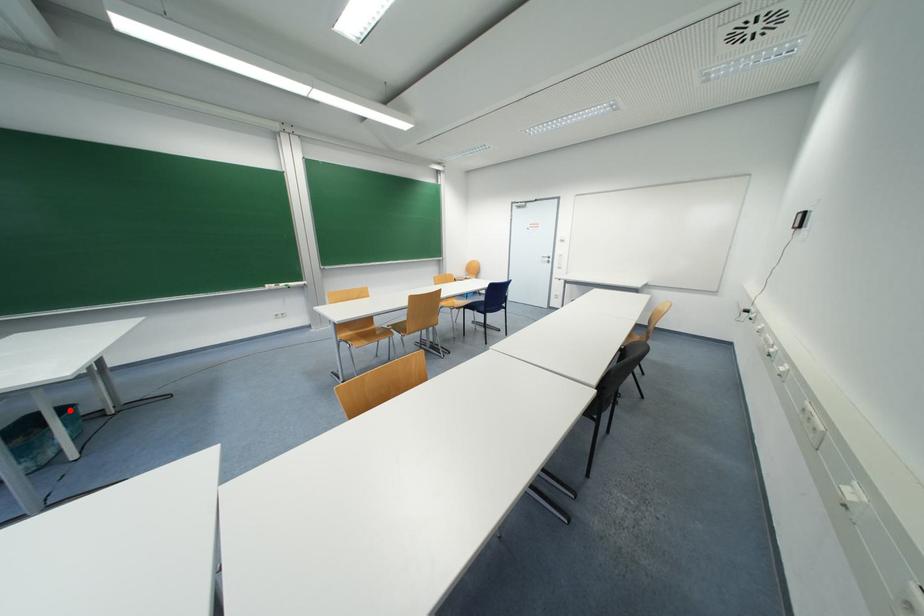
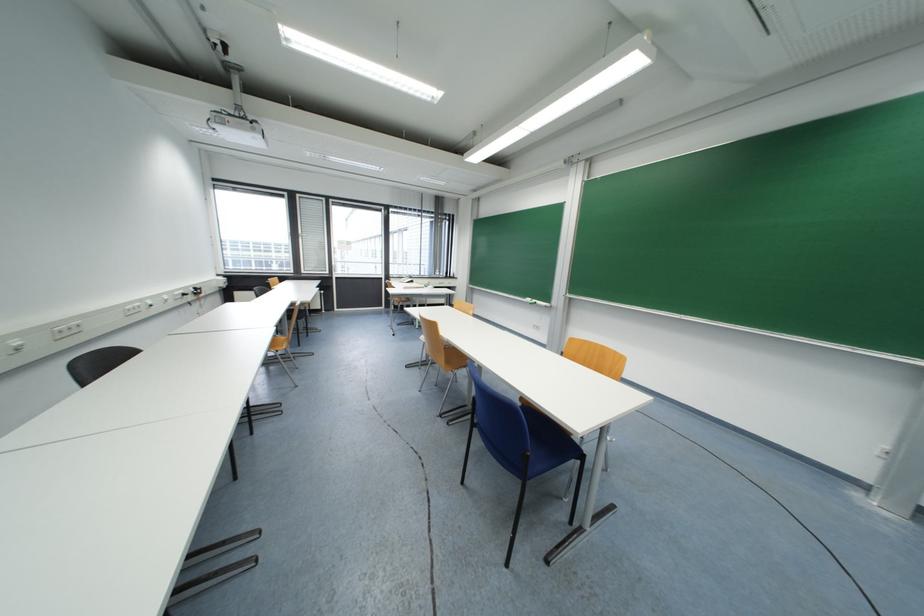
Question: I am providing you with two images of the same scene from different viewpoints. A red point is marked on the first image. At the location where the point appears in image 1, is it still visible in image 2?

Choices:
 (A) Yes
 (B) No

Answer: (B)